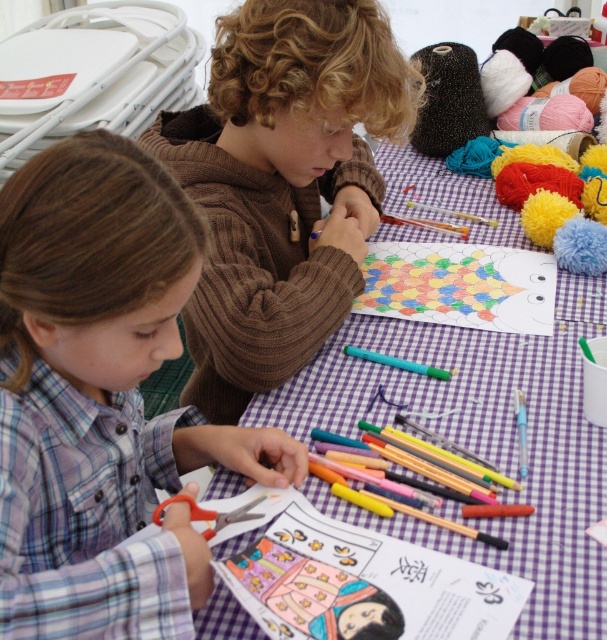
You are a teacher observing the scene. You need to determine if the brown knitted sweater at upper center can be placed on the purple checkered table at center without hanging over the edge. Can it fit?

The brown knitted sweater at upper center is shorter than the purple checkered table at center, so it can fit on the table without hanging over the edge.

You are a teacher observing the children at the table. You notice an object at point (282, 184). What is the object located there?

The object at point (282, 184) is the brown knitted sweater at upper center.

You are trying to reach the orange plastic scissors at lower left from your current position near the purple checkered table at center. Which direction should you move to get them?

Since the purple checkered table at center is closer to you than the orange plastic scissors at lower left, you should move towards the lower left direction to reach the orange plastic scissors at lower left.